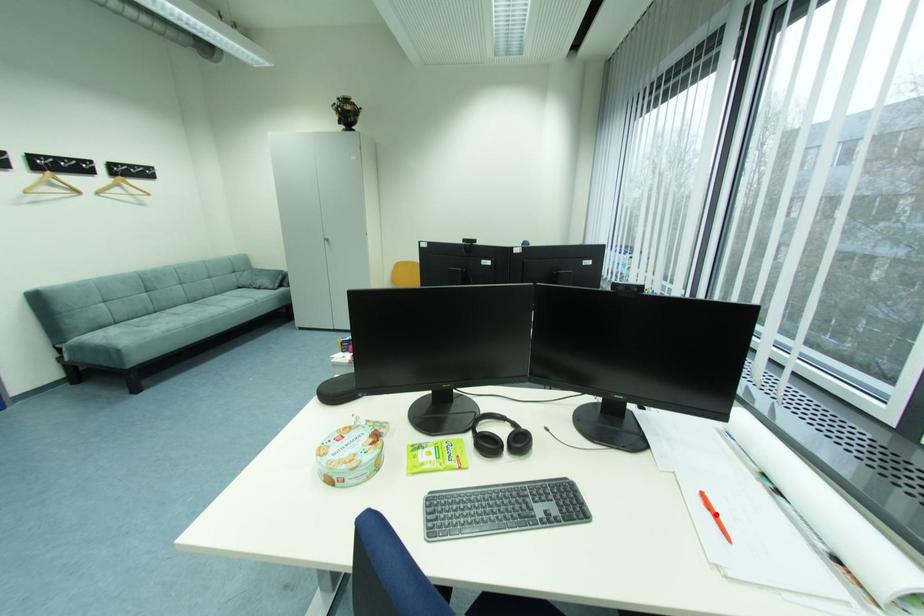
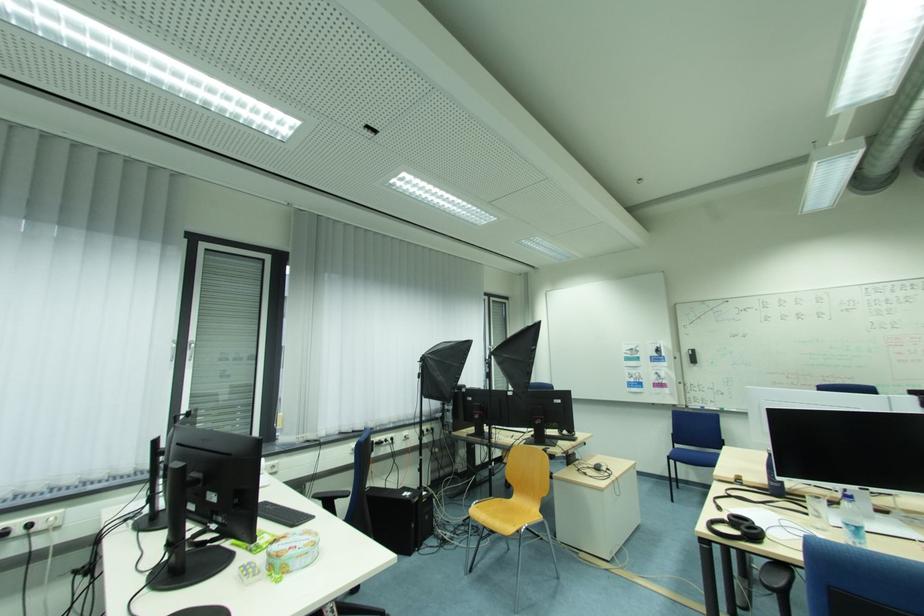
Question: I am providing you with two images of the same scene from different viewpoints. A red point is marked on the first image. Is the red point's position out of view in image 2?

Choices:
 (A) Yes
 (B) No

Answer: (A)